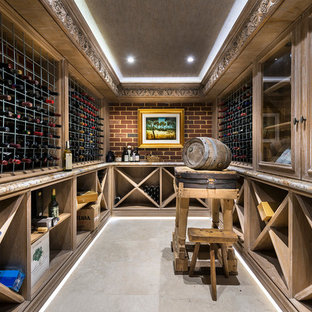
Where is `picture`? This screenshot has height=312, width=312. picture is located at coordinates (158, 126).